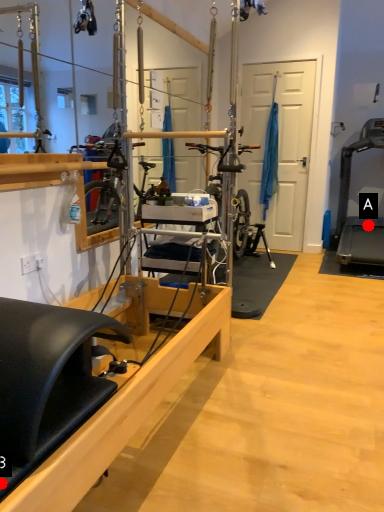
Question: Two points are circled on the image, labeled by A and B beside each circle. Which point is farther from the camera taking this photo?

Choices:
 (A) A is further
 (B) B is further

Answer: (A)